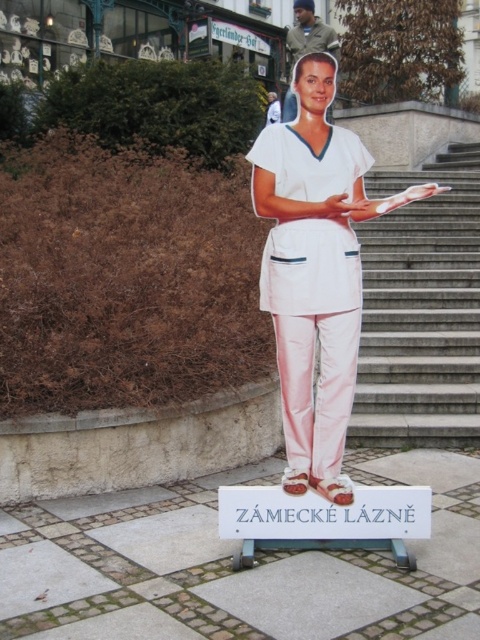
You need to place a 1.5 meter wide equipment cart between the smooth concrete stairs at center and the white smooth uniform at center. Is there enough space?

The smooth concrete stairs at center is narrower than the white smooth uniform at center, but the exact width difference isn not specified. Without knowing the actual widths, it is impossible to determine if the 1.5 meter cart will fit.

You are standing in front of the cardboard cutout and need to locate the smooth concrete stairs at center. Based on the coordinates provided, where should you look relative to the cutout?

The smooth concrete stairs at center are located at coordinates point (x=420, y=310), so you should look towards the center area in front of the cardboard cutout to find them.

You are a delivery person trying to navigate through the area. You see the smooth concrete stairs at center and the white smooth uniform at center. Which one is bigger in size?

The white smooth uniform at center is bigger in size compared to the smooth concrete stairs at center.